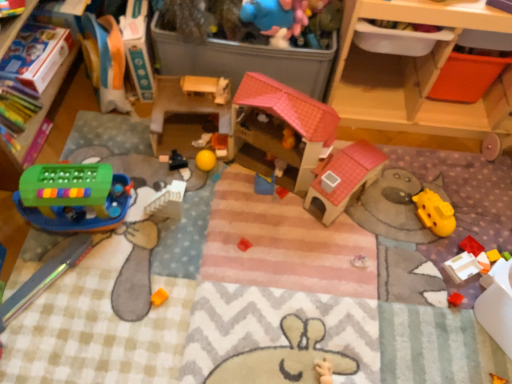
This screenshot has width=512, height=384. Find the location of `vacant area in front of yellow plastic spoon at center, the 7th toy when ordered from left to right`. vacant area in front of yellow plastic spoon at center, the 7th toy when ordered from left to right is located at coordinates (260, 230).